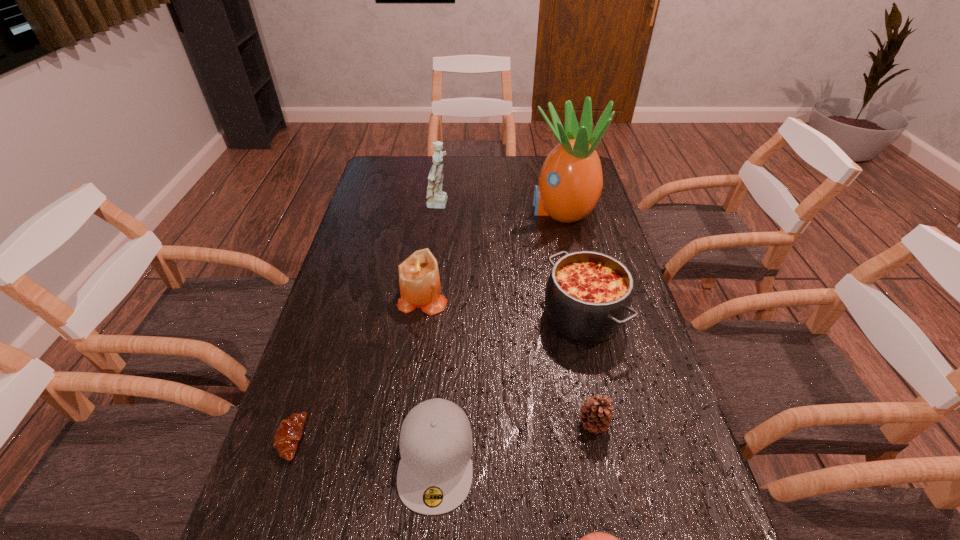
Where is `the tallest object`? The width and height of the screenshot is (960, 540). the tallest object is located at coordinates (570, 183).

The image size is (960, 540). In order to click on the seventh shortest object in this screenshot , I will do `click(436, 198)`.

Where is `candle`? This screenshot has width=960, height=540. candle is located at coordinates (419, 281).

Where is `casserole`? The image size is (960, 540). casserole is located at coordinates (588, 296).

Image resolution: width=960 pixels, height=540 pixels. I want to click on pinecone, so click(596, 414).

Locate an element on the screen. This screenshot has width=960, height=540. cap is located at coordinates (434, 476).

What are the coordinates of `the shortest object` in the screenshot? It's located at coord(288,434).

At what (x,y) coordinates should I click in order to perform the action: click on crescent roll. Please return your answer as a coordinate pair (x, y). Image resolution: width=960 pixels, height=540 pixels. Looking at the image, I should click on (288, 434).

At what (x,y) coordinates should I click in order to perform the action: click on free space located 0.060m at the entrance of the pineapple. Please return your answer as a coordinate pair (x, y). This screenshot has height=540, width=960. Looking at the image, I should click on (512, 210).

The width and height of the screenshot is (960, 540). I want to click on free location located 0.230m at the entrance of the pineapple, so click(x=464, y=210).